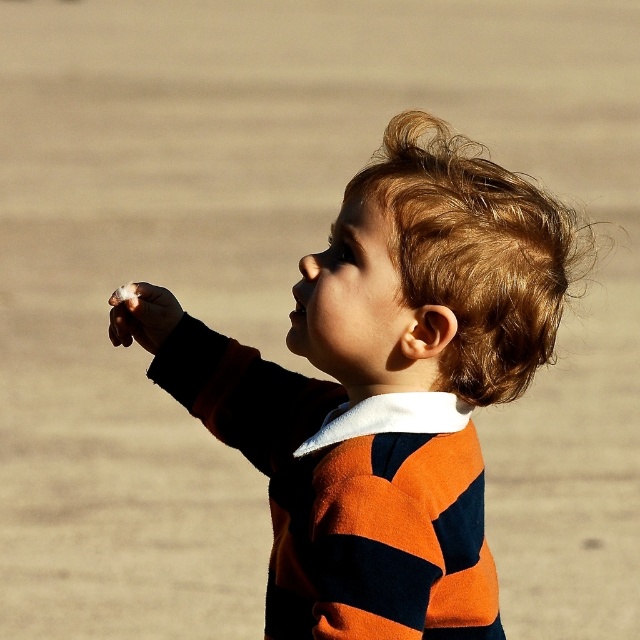
Question: Which point appears closest to the camera in this image?

Choices:
 (A) (348, 256)
 (B) (454, 237)
 (C) (136, 307)

Answer: (B)

Question: Does striped sweater at center have a larger size compared to white cotton candy at lower left?

Choices:
 (A) no
 (B) yes

Answer: (B)

Question: Which of the following is the farthest from the observer?

Choices:
 (A) striped sweater at center
 (B) white cotton candy at lower left
 (C) blonde textured hair at upper right

Answer: (B)

Question: Is blonde textured hair at upper right closer to camera compared to white cotton candy at lower left?

Choices:
 (A) yes
 (B) no

Answer: (A)

Question: Which object appears closest to the camera in this image?

Choices:
 (A) striped sweater at center
 (B) blonde textured hair at upper right

Answer: (A)

Question: Does blonde textured hair at upper right appear over white cotton candy at lower left?

Choices:
 (A) yes
 (B) no

Answer: (A)